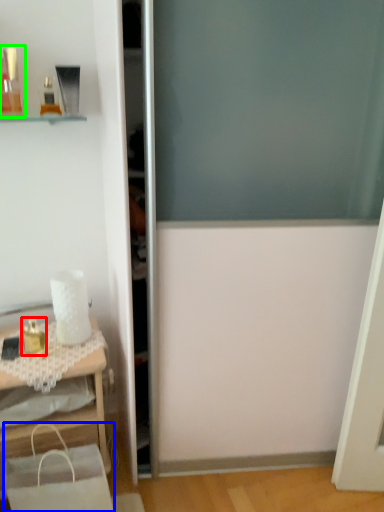
Question: Which is nearer to the toiletry (highlighted by a red box)? shopping bag (highlighted by a blue box) or toiletry (highlighted by a green box).

Choices:
 (A) shopping bag
 (B) toiletry

Answer: (A)